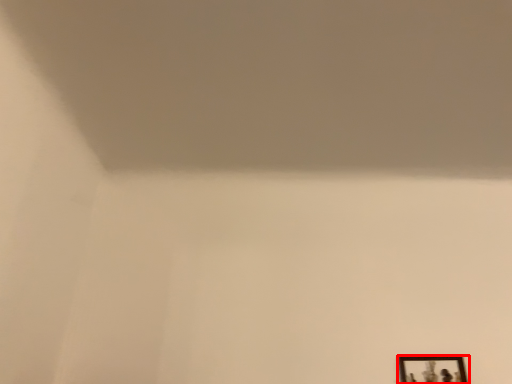
Question: Where is picture frame (annotated by the red box) located in relation to wide in the image?

Choices:
 (A) right
 (B) left

Answer: (A)